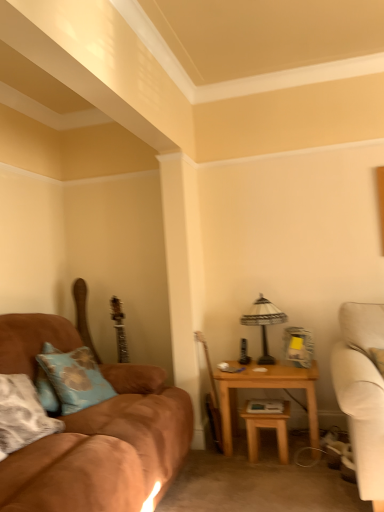
From the picture: In order to face light brown wooden table at right, which ranks as the 1th table in right-to-left order, should I rotate leftwards or rightwards?

A 10.334 degree turn to the right will do.

Locate an element on the screen. The image size is (384, 512). blue fabric pillow at left is located at coordinates (70, 380).

Locate an element on the screen. light brown wooden table at right, the second table positioned from the left is located at coordinates [x=265, y=388].

Is suede brown couch at left turned away from light brown wooden table at right, which ranks as the 1th table in right-to-left order?

No, light brown wooden table at right, which ranks as the 1th table in right-to-left order, is not at the back of suede brown couch at left.

This screenshot has height=512, width=384. I want to click on table that is the 1st object located below the suede brown couch at left (from the image's perspective), so click(265, 388).

From a real-world perspective, between suede brown couch at left and light brown wooden table at right, the second table positioned from the left, who is vertically higher?

suede brown couch at left is physically above.

Which of these two, wooden table at right, arranged as the first table when viewed from the left, or light brown wooden table at right, the second table positioned from the left, is smaller?

wooden table at right, arranged as the first table when viewed from the left, is smaller.

From a real-world perspective, is wooden table at right, which is the second table in right-to-left order, located beneath light brown wooden table at right, which ranks as the 1th table in right-to-left order?

Yes.

Consider the image. From the image's perspective, which one is positioned higher, wooden table at right, arranged as the first table when viewed from the left, or light brown wooden table at right, which ranks as the 1th table in right-to-left order?

light brown wooden table at right, which ranks as the 1th table in right-to-left order, from the image's perspective.

Considering the relative sizes of wooden table at right, arranged as the first table when viewed from the left, and light brown wooden table at right, which ranks as the 1th table in right-to-left order, in the image provided, is wooden table at right, arranged as the first table when viewed from the left, taller than light brown wooden table at right, which ranks as the 1th table in right-to-left order,?

Incorrect, the height of wooden table at right, arranged as the first table when viewed from the left, is not larger of that of light brown wooden table at right, which ranks as the 1th table in right-to-left order.

From a real-world perspective, is suede brown couch at left physically located above or below blue fabric pillow at left?

In terms of real-world spatial position, suede brown couch at left is below blue fabric pillow at left.

Which object is further away from the camera, suede brown couch at left or blue fabric pillow at left?

blue fabric pillow at left is behind.

Considering the relative sizes of blue fabric pillow at left and white textured lampshade at right in the image provided, is blue fabric pillow at left taller than white textured lampshade at right?

In fact, blue fabric pillow at left may be shorter than white textured lampshade at right.

Can you tell me how much blue fabric pillow at left and white textured lampshade at right differ in facing direction?

The angular difference between blue fabric pillow at left and white textured lampshade at right is 77.3 degrees.

Is blue fabric pillow at left completely or partially outside of white textured lampshade at right?

Yes, blue fabric pillow at left is located beyond the bounds of white textured lampshade at right.

From the image's perspective, which one is positioned lower, blue fabric pillow at left or white textured lampshade at right?

From the image's view, blue fabric pillow at left is below.

From the picture: Does white textured lampshade at right have a smaller size compared to wooden table at right, arranged as the first table when viewed from the left?

Incorrect, white textured lampshade at right is not smaller in size than wooden table at right, arranged as the first table when viewed from the left.

Looking at this image, from the image's perspective, which one is positioned lower, white textured lampshade at right or wooden table at right, arranged as the first table when viewed from the left?

wooden table at right, arranged as the first table when viewed from the left, from the image's perspective.

From a real-world perspective, which object rests below the other?

In real-world perspective, wooden table at right, which is the second table in right-to-left order, is lower.

Which is closer to the camera, (x=263, y=355) or (x=257, y=460)?

Point (x=263, y=355).

Is light brown wooden table at right, which ranks as the 1th table in right-to-left order, next to wooden table at right, arranged as the first table when viewed from the left?

No, light brown wooden table at right, which ranks as the 1th table in right-to-left order, is not with wooden table at right, arranged as the first table when viewed from the left.

Can you confirm if light brown wooden table at right, which ranks as the 1th table in right-to-left order, is bigger than wooden table at right, arranged as the first table when viewed from the left?

Yes, light brown wooden table at right, which ranks as the 1th table in right-to-left order, is bigger than wooden table at right, arranged as the first table when viewed from the left.

Considering the positions of objects light brown wooden table at right, the second table positioned from the left, and wooden table at right, arranged as the first table when viewed from the left, in the image provided, who is more to the left, light brown wooden table at right, the second table positioned from the left, or wooden table at right, arranged as the first table when viewed from the left,?

Positioned to the left is wooden table at right, arranged as the first table when viewed from the left.

From a real-world perspective, is white textured lampshade at right physically located above or below suede brown couch at left?

In terms of real-world spatial position, white textured lampshade at right is above suede brown couch at left.

Considering the positions of point (267, 318) and point (151, 477), is point (267, 318) closer or farther from the camera than point (151, 477)?

Point (267, 318) is farther from the camera than point (151, 477).

Is white textured lampshade at right to the left or to the right of suede brown couch at left in the image?

Clearly, white textured lampshade at right is on the right of suede brown couch at left in the image.

Is white textured lampshade at right positioned with its back to suede brown couch at left?

white textured lampshade at right is not turned away from suede brown couch at left.

Locate an element on the screen. the 2nd table behind the suede brown couch at left, starting your count from the anchor is located at coordinates (265, 388).

The width and height of the screenshot is (384, 512). I want to click on table below the light brown wooden table at right, which ranks as the 1th table in right-to-left order (from a real-world perspective), so click(x=266, y=428).

Looking at the image, which one is located closer to blue fabric pillow at left, light brown wooden table at right, which ranks as the 1th table in right-to-left order, or wooden table at right, arranged as the first table when viewed from the left?

Among the two, light brown wooden table at right, which ranks as the 1th table in right-to-left order, is located nearer to blue fabric pillow at left.

Looking at the image, which one is located further to wooden table at right, which is the second table in right-to-left order, white textured lampshade at right or blue fabric pillow at left?

Among the two, blue fabric pillow at left is located further to wooden table at right, which is the second table in right-to-left order.

Considering their positions, is white textured lampshade at right positioned closer to light brown wooden table at right, the second table positioned from the left, than suede brown couch at left?

white textured lampshade at right.

Looking at the image, which one is located further to light brown wooden table at right, the second table positioned from the left, blue fabric pillow at left or wooden table at right, arranged as the first table when viewed from the left?

blue fabric pillow at left.

Considering their positions, is blue fabric pillow at left positioned closer to wooden table at right, which is the second table in right-to-left order, than white textured lampshade at right?

white textured lampshade at right lies closer to wooden table at right, which is the second table in right-to-left order, than the other object.

Which object lies further to the anchor point light brown wooden table at right, which ranks as the 1th table in right-to-left order, wooden table at right, which is the second table in right-to-left order, or blue fabric pillow at left?

Among the two, blue fabric pillow at left is located further to light brown wooden table at right, which ranks as the 1th table in right-to-left order.

From the picture: When comparing their distances from light brown wooden table at right, the second table positioned from the left, does wooden table at right, which is the second table in right-to-left order, or suede brown couch at left seem closer?

wooden table at right, which is the second table in right-to-left order.

Estimate the real-world distances between objects in this image. Which object is closer to white textured lampshade at right, light brown wooden table at right, which ranks as the 1th table in right-to-left order, or suede brown couch at left?

light brown wooden table at right, which ranks as the 1th table in right-to-left order, is positioned closer to the anchor white textured lampshade at right.

Where is `table between white textured lampshade at right and wooden table at right, arranged as the first table when viewed from the left, vertically`? The image size is (384, 512). table between white textured lampshade at right and wooden table at right, arranged as the first table when viewed from the left, vertically is located at coordinates (265, 388).

The image size is (384, 512). Find the location of `table located between blue fabric pillow at left and light brown wooden table at right, which ranks as the 1th table in right-to-left order, in the left-right direction`. table located between blue fabric pillow at left and light brown wooden table at right, which ranks as the 1th table in right-to-left order, in the left-right direction is located at coordinates (266, 428).

This screenshot has height=512, width=384. What are the coordinates of `pillow positioned between suede brown couch at left and wooden table at right, arranged as the first table when viewed from the left, from near to far` in the screenshot? It's located at (x=70, y=380).

Find the location of a particular element. pillow positioned between suede brown couch at left and light brown wooden table at right, which ranks as the 1th table in right-to-left order, from near to far is located at coordinates (70, 380).